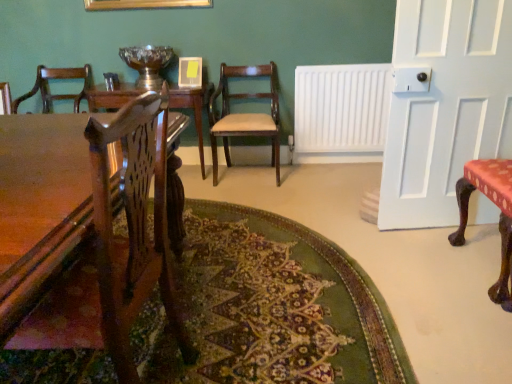
This screenshot has height=384, width=512. Find the location of `space that is in front of white painted wood door at right`. space that is in front of white painted wood door at right is located at coordinates (434, 260).